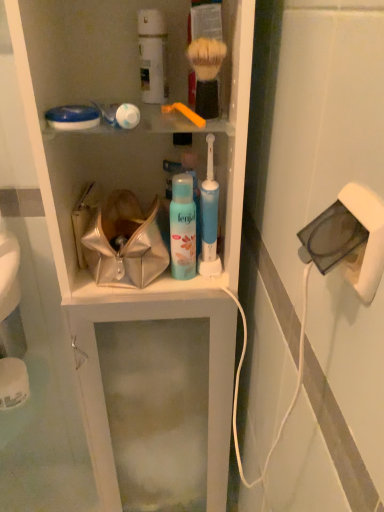
The image size is (384, 512). I want to click on blue plastic toothbrush at center, which is counted as the second toiletry, starting from the top, so click(209, 208).

The image size is (384, 512). Describe the element at coordinates (159, 274) in the screenshot. I see `white plastic cabinet at center` at that location.

The width and height of the screenshot is (384, 512). Identify the location of white matte canister at upper center, which is counted as the second toiletry, starting from the bottom. (152, 56).

Describe the element at coordinates (152, 56) in the screenshot. I see `white matte canister at upper center, which appears as the 1th toiletry when viewed from the left` at that location.

Find the location of a particular element. The height and width of the screenshot is (512, 384). metallic shiny handbag at center is located at coordinates (127, 241).

What's the angular difference between white plastic electric outlet at right and soft bristle shaving brush at upper center, marked as the second brush in a left-to-right arrangement,'s facing directions?

white plastic electric outlet at right and soft bristle shaving brush at upper center, marked as the second brush in a left-to-right arrangement, are facing 90.2 degrees away from each other.

Would you say white plastic electric outlet at right is outside soft bristle shaving brush at upper center, which is the 1th brush from right to left?

Yes, white plastic electric outlet at right is located beyond the bounds of soft bristle shaving brush at upper center, which is the 1th brush from right to left.

Between white plastic electric outlet at right and soft bristle shaving brush at upper center, which is the 1th brush from right to left, which one is positioned behind?

soft bristle shaving brush at upper center, which is the 1th brush from right to left.

From a real-world perspective, is white plastic electric outlet at right above or below soft bristle shaving brush at upper center, which is the 1th brush from right to left?

white plastic electric outlet at right is below soft bristle shaving brush at upper center, which is the 1th brush from right to left.

Considering the sizes of objects blue plastic toothbrush at center, which is counted as the second toiletry, starting from the top, and soft bristle shaving brush at upper center, marked as the second brush in a left-to-right arrangement, in the image provided, who is thinner, blue plastic toothbrush at center, which is counted as the second toiletry, starting from the top, or soft bristle shaving brush at upper center, marked as the second brush in a left-to-right arrangement,?

Thinner between the two is soft bristle shaving brush at upper center, marked as the second brush in a left-to-right arrangement.

Which is in front, point (201, 196) or point (206, 68)?

The point (206, 68) is closer to the camera.

Are blue plastic toothbrush at center, arranged as the 1th toiletry when viewed from the right, and soft bristle shaving brush at upper center, which is the 1th brush from right to left, beside each other?

There is a gap between blue plastic toothbrush at center, arranged as the 1th toiletry when viewed from the right, and soft bristle shaving brush at upper center, which is the 1th brush from right to left.

Can you confirm if white matte canister at upper center, which is the second toiletry in right-to-left order, is positioned to the right of white plastic electric outlet at right?

No, white matte canister at upper center, which is the second toiletry in right-to-left order, is not to the right of white plastic electric outlet at right.

From a real-world perspective, does white matte canister at upper center, which is the second toiletry in right-to-left order, sit lower than white plastic electric outlet at right?

Actually, white matte canister at upper center, which is the second toiletry in right-to-left order, is physically above white plastic electric outlet at right in the real world.

Where is `toiletry that is the 2nd one when counting backward from the white plastic electric outlet at right`? toiletry that is the 2nd one when counting backward from the white plastic electric outlet at right is located at coordinates (152, 56).

Based on the photo, who is bigger, white matte canister at upper center, which appears as the 1th toiletry when viewed from the left, or white plastic electric outlet at right?

With larger size is white matte canister at upper center, which appears as the 1th toiletry when viewed from the left.

Is point (351, 211) in front of point (189, 260)?

Yes, it is in front of point (189, 260).

How many degrees apart are the facing directions of white plastic electric outlet at right and blue matte bottle at center?

90.2 degrees separate the facing orientations of white plastic electric outlet at right and blue matte bottle at center.

Is white plastic electric outlet at right shorter than blue matte bottle at center?

Yes, white plastic electric outlet at right is shorter than blue matte bottle at center.

From the picture: From the image's perspective, is white plastic electric outlet at right above blue matte bottle at center?

No, from the image's perspective, white plastic electric outlet at right is not on top of blue matte bottle at center.

Can you see white plastic cabinet at center touching soft bristle shaving brush at upper center, marked as the second brush in a left-to-right arrangement?

No, white plastic cabinet at center is not next to soft bristle shaving brush at upper center, marked as the second brush in a left-to-right arrangement.

Is white plastic cabinet at center facing away from soft bristle shaving brush at upper center, marked as the second brush in a left-to-right arrangement?

No.

In terms of height, does white plastic cabinet at center look taller or shorter compared to soft bristle shaving brush at upper center, marked as the second brush in a left-to-right arrangement?

white plastic cabinet at center is taller than soft bristle shaving brush at upper center, marked as the second brush in a left-to-right arrangement.

Which of these two, white matte canister at upper center, which is counted as the second toiletry, starting from the bottom, or white plastic cabinet at center, is wider?

white plastic cabinet at center is wider.

From a real-world perspective, which object rests below the other?

In real-world perspective, white plastic cabinet at center is lower.

Considering the sizes of white matte canister at upper center, which appears as the 1th toiletry when viewed from the left, and white plastic cabinet at center in the image, is white matte canister at upper center, which appears as the 1th toiletry when viewed from the left, taller or shorter than white plastic cabinet at center?

white matte canister at upper center, which appears as the 1th toiletry when viewed from the left, is shorter than white plastic cabinet at center.

Does white matte canister at upper center, positioned as the first toiletry in top-to-bottom order, have a smaller size compared to yellow plastic toothbrush at upper center, the 1th brush positioned from the left?

Incorrect, white matte canister at upper center, positioned as the first toiletry in top-to-bottom order, is not smaller in size than yellow plastic toothbrush at upper center, the 1th brush positioned from the left.

Considering the sizes of objects white matte canister at upper center, which appears as the 1th toiletry when viewed from the left, and yellow plastic toothbrush at upper center, the 1th brush positioned from the left, in the image provided, who is shorter, white matte canister at upper center, which appears as the 1th toiletry when viewed from the left, or yellow plastic toothbrush at upper center, the 1th brush positioned from the left,?

With less height is yellow plastic toothbrush at upper center, the 1th brush positioned from the left.

Based on the photo, is yellow plastic toothbrush at upper center, the 1th brush positioned from the left, at the back of white matte canister at upper center, which is counted as the second toiletry, starting from the bottom?

No, white matte canister at upper center, which is counted as the second toiletry, starting from the bottom,'s orientation is not away from yellow plastic toothbrush at upper center, the 1th brush positioned from the left.

From the image's perspective, which is below, white matte canister at upper center, which is the second toiletry in right-to-left order, or yellow plastic toothbrush at upper center, the 1th brush positioned from the left?

yellow plastic toothbrush at upper center, the 1th brush positioned from the left, is shown below in the image.

The image size is (384, 512). What are the coordinates of `the 1st brush counting from the left of the white plastic electric outlet at right` in the screenshot? It's located at (206, 74).

You are a GUI agent. You are given a task and a screenshot of the screen. Output one action in this format:
    pyautogui.click(x=<x>, y=<y>)
    Task: Click on the 2nd brush above the blue plastic toothbrush at center, arranged as the 1th toiletry when viewed from the right (from a real-world perspective)
    The width and height of the screenshot is (384, 512).
    Given the screenshot: What is the action you would take?
    pyautogui.click(x=206, y=74)

Which object lies further to the anchor point soft bristle shaving brush at upper center, which is the 1th brush from right to left, blue plastic toothbrush at center, which is counted as the 2th toiletry, starting from the left, or yellow plastic toothbrush at upper center, the 2th brush in the right-to-left sequence?

blue plastic toothbrush at center, which is counted as the 2th toiletry, starting from the left, is further to soft bristle shaving brush at upper center, which is the 1th brush from right to left.

From the image, which object appears to be farther from yellow plastic toothbrush at upper center, the 2th brush in the right-to-left sequence, white plastic electric outlet at right or white plastic cabinet at center?

Among the two, white plastic cabinet at center is located further to yellow plastic toothbrush at upper center, the 2th brush in the right-to-left sequence.

Considering their positions, is yellow plastic toothbrush at upper center, the 1th brush positioned from the left, positioned closer to soft bristle shaving brush at upper center, which is the 1th brush from right to left, than white plastic cabinet at center?

The object closer to soft bristle shaving brush at upper center, which is the 1th brush from right to left, is yellow plastic toothbrush at upper center, the 1th brush positioned from the left.

From the image, which object appears to be nearer to white matte canister at upper center, positioned as the first toiletry in top-to-bottom order, blue plastic toothbrush at center, which is counted as the 2th toiletry, starting from the left, or white plastic electric outlet at right?

blue plastic toothbrush at center, which is counted as the 2th toiletry, starting from the left.

Which object lies further to the anchor point blue plastic toothbrush at center, the first toiletry when ordered from bottom to top, blue matte bottle at center or white matte canister at upper center, positioned as the first toiletry in top-to-bottom order?

white matte canister at upper center, positioned as the first toiletry in top-to-bottom order, lies further to blue plastic toothbrush at center, the first toiletry when ordered from bottom to top, than the other object.

Which object lies nearer to the anchor point blue plastic toothbrush at center, the first toiletry when ordered from bottom to top, white plastic cabinet at center or blue matte bottle at center?

The object closer to blue plastic toothbrush at center, the first toiletry when ordered from bottom to top, is blue matte bottle at center.

Based on the photo, from the image, which object appears to be farther from yellow plastic toothbrush at upper center, the 1th brush positioned from the left, white plastic cabinet at center or metallic shiny handbag at center?

white plastic cabinet at center is further to yellow plastic toothbrush at upper center, the 1th brush positioned from the left.

Estimate the real-world distances between objects in this image. Which object is further from white plastic electric outlet at right, blue plastic toothbrush at center, which is counted as the second toiletry, starting from the top, or blue matte bottle at center?

blue plastic toothbrush at center, which is counted as the second toiletry, starting from the top.

Locate an element on the screen. The image size is (384, 512). mouthwash that lies between blue plastic toothbrush at center, arranged as the 1th toiletry when viewed from the right, and white plastic cabinet at center from top to bottom is located at coordinates click(182, 228).

The image size is (384, 512). What are the coordinates of `toiletry between yellow plastic toothbrush at upper center, the 2th brush in the right-to-left sequence, and white plastic cabinet at center, in the vertical direction` in the screenshot? It's located at (209, 208).

This screenshot has height=512, width=384. What are the coordinates of `brush between soft bristle shaving brush at upper center, marked as the second brush in a left-to-right arrangement, and blue matte bottle at center vertically` in the screenshot? It's located at (185, 113).

What are the coordinates of `handbag between yellow plastic toothbrush at upper center, the 2th brush in the right-to-left sequence, and blue matte bottle at center vertically` in the screenshot? It's located at tap(127, 241).